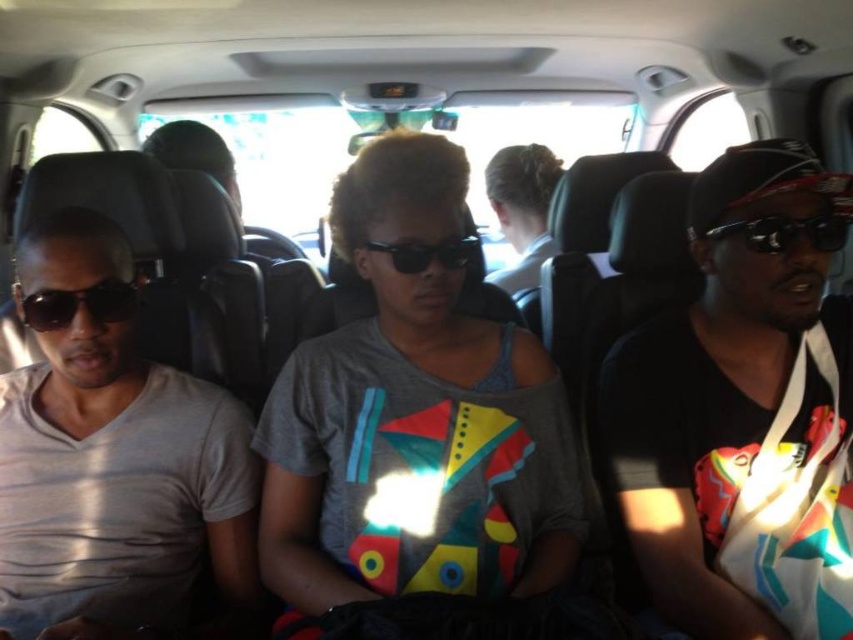
Question: Estimate the real-world distances between objects in this image. Which object is closer to the gray cotton t-shirt at center?

Choices:
 (A) matte black sunglasses at left
 (B) black plastic sunglasses at right
 (C) black plastic sunglasses at center

Answer: (C)

Question: Which point is farther from the camera taking this photo?

Choices:
 (A) (410, 378)
 (B) (461, 260)
 (C) (117, 291)

Answer: (A)

Question: Which point is closer to the camera?

Choices:
 (A) (466, 250)
 (B) (820, 216)

Answer: (A)

Question: Does matte black sunglasses at left appear under black plastic sunglasses at right?

Choices:
 (A) no
 (B) yes

Answer: (B)

Question: Is matte black sunglasses at left to the right of black plastic sunglasses at right from the viewer's perspective?

Choices:
 (A) yes
 (B) no

Answer: (B)

Question: Is matte black sunglasses at left smaller than black plastic sunglasses at center?

Choices:
 (A) yes
 (B) no

Answer: (A)